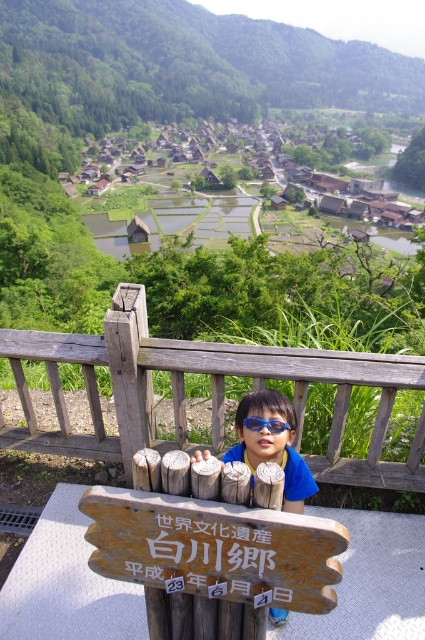
Question: Does blue plastic sunglasses at center have a smaller size compared to blue plastic goggles at center?

Choices:
 (A) no
 (B) yes

Answer: (A)

Question: In this image, where is wooden sign at center located relative to blue plastic goggles at center?

Choices:
 (A) right
 (B) left

Answer: (B)

Question: Which point is farther from the camera taking this photo?

Choices:
 (A) (263, 408)
 (B) (133, 536)

Answer: (A)

Question: Which object is positioned farthest from the weathered wood at center?

Choices:
 (A) blue plastic sunglasses at center
 (B) wooden sign at center

Answer: (B)

Question: Does weathered wood at center lie behind wooden sign at center?

Choices:
 (A) yes
 (B) no

Answer: (A)

Question: Estimate the real-world distances between objects in this image. Which object is closer to the blue plastic sunglasses at center?

Choices:
 (A) weathered wood at center
 (B) wooden sign at center

Answer: (B)